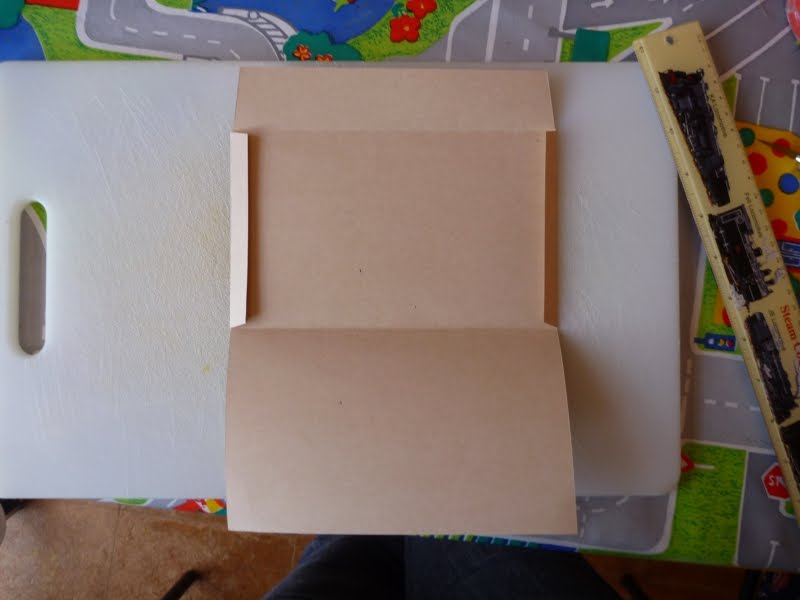
You are a GUI agent. You are given a task and a screenshot of the screen. Output one action in this format:
    pyautogui.click(x=<x>, y=<y>)
    Task: Click on the cutting board
    
    Given the screenshot: What is the action you would take?
    pyautogui.click(x=140, y=357)